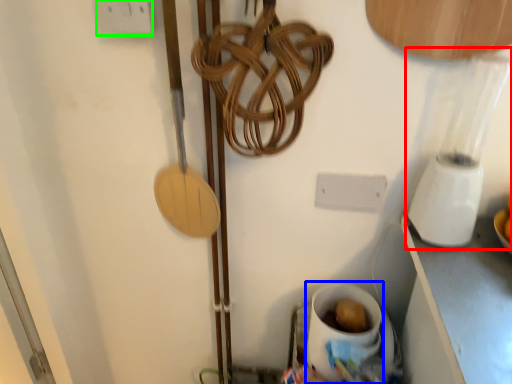
Question: Estimate the real-world distances between objects in this image. Which object is closer to blender (highlighted by a red box), coffee cup (highlighted by a blue box) or electric outlet (highlighted by a green box)?

Choices:
 (A) coffee cup
 (B) electric outlet

Answer: (A)